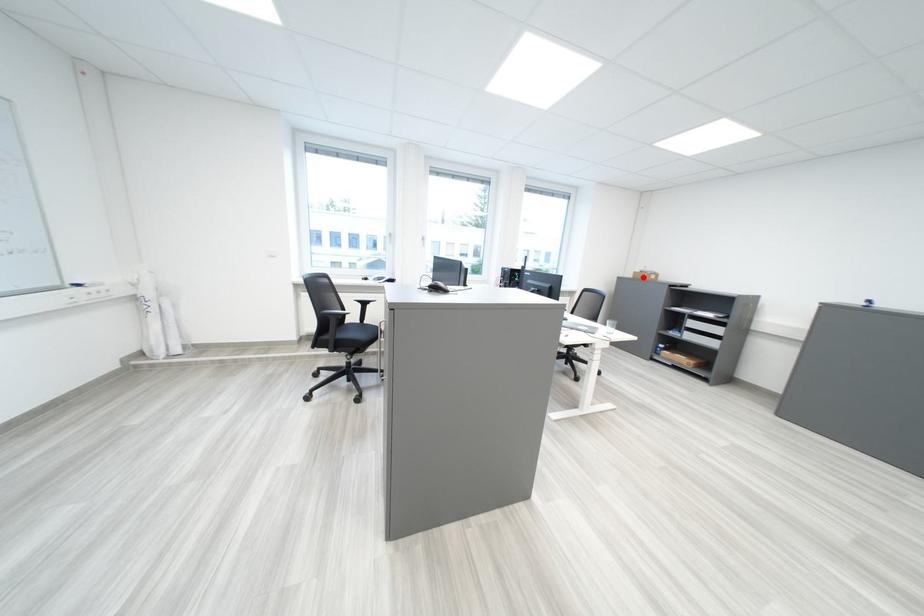
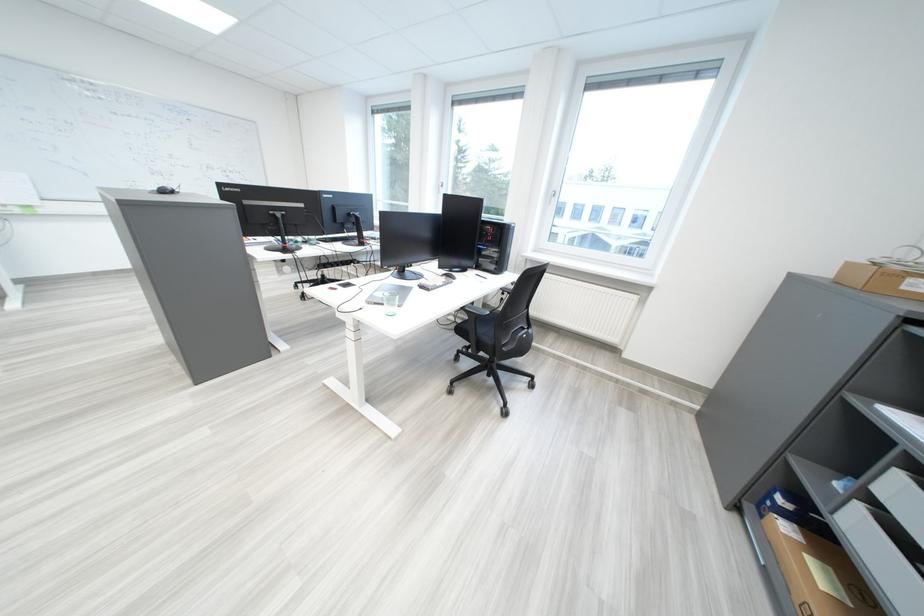
Find the pixel in the second image that matches the highlighted location in the first image.

(839, 274)